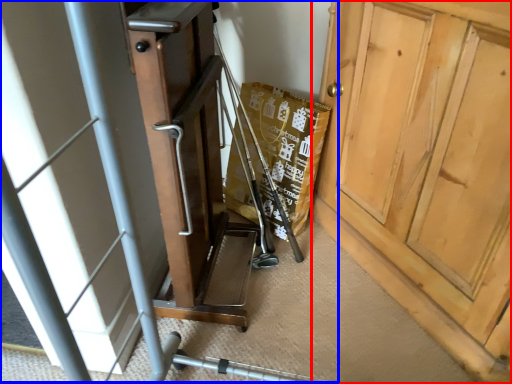
Question: Which point is closer to the camera, door (highlighted by a red box) or baby carriage (highlighted by a blue box)?

Choices:
 (A) door
 (B) baby carriage

Answer: (B)